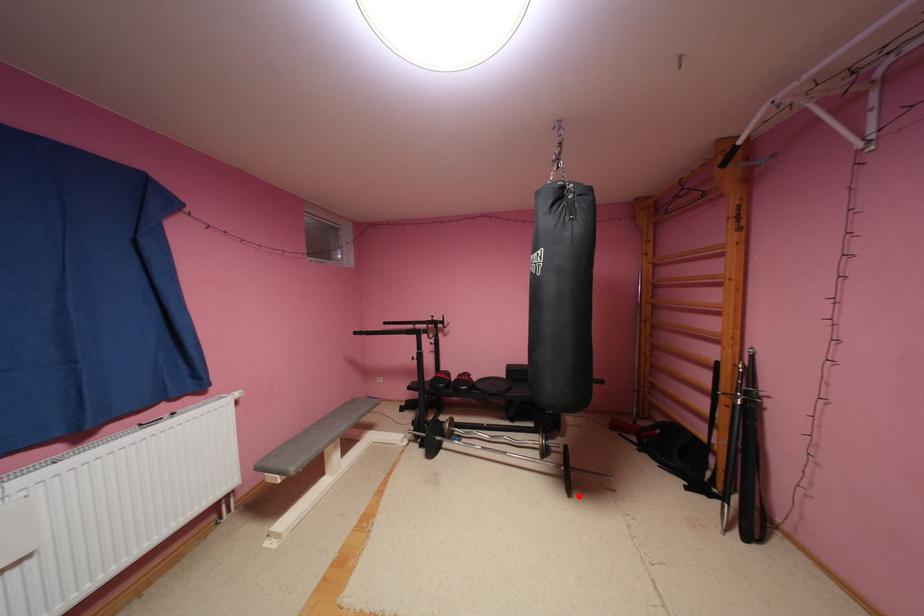
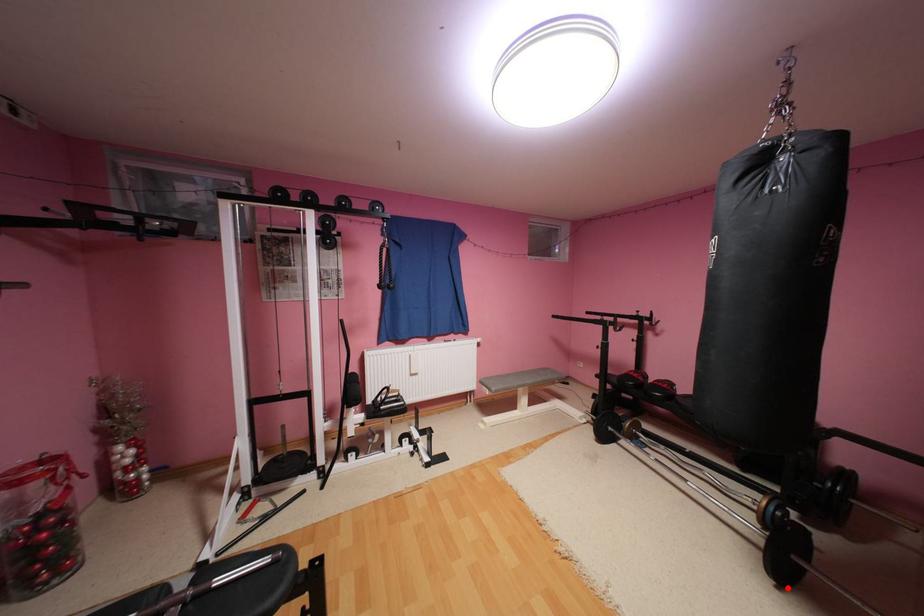
Consider the image. I am providing you with two images of the same scene from different viewpoints. A red point is marked on the first image and another point is marked on the second image. Is the marked point in image1 the same physical position as the marked point in image2?

Yes